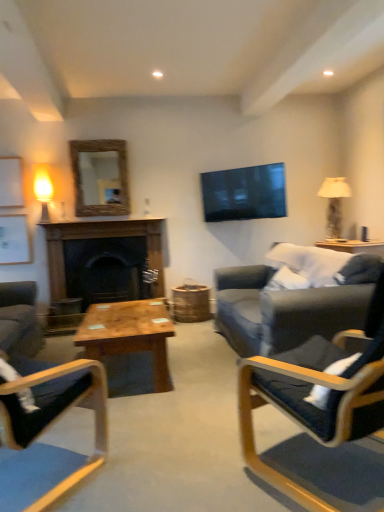
Question: Considering the positions of matte glass lamp at left, which is the first lamp from left to right, and rustic wood mirror at upper center in the image, is matte glass lamp at left, which is the first lamp from left to right, wider or thinner than rustic wood mirror at upper center?

Choices:
 (A) wide
 (B) thin

Answer: (A)

Question: From a real-world perspective, is matte glass lamp at left, which is the first lamp from left to right, positioned above or below rustic wood mirror at upper center?

Choices:
 (A) above
 (B) below

Answer: (B)

Question: Considering the real-world distances, which object is farthest from the matte black chair at right, placed as the 1th chair when sorted from right to left?

Choices:
 (A) wooden armchair at center, which appears as the second chair when viewed from the right
 (B) wooden coffee table at center
 (C) matte glass lamp at left, placed as the 2th lamp when sorted from right to left
 (D) white fabric lampshade at right, positioned as the 2th lamp in left-to-right order
 (E) rustic wood mirror at upper center

Answer: (C)

Question: Which of these objects is positioned closest to the dark wood fireplace at center?

Choices:
 (A) white fabric lampshade at right, which is the 1th lamp in right-to-left order
 (B) matte glass lamp at left, which is the first lamp from left to right
 (C) wooden coffee table at center
 (D) rustic wood mirror at upper center
 (E) matte black chair at right, placed as the 1th chair when sorted from right to left

Answer: (D)